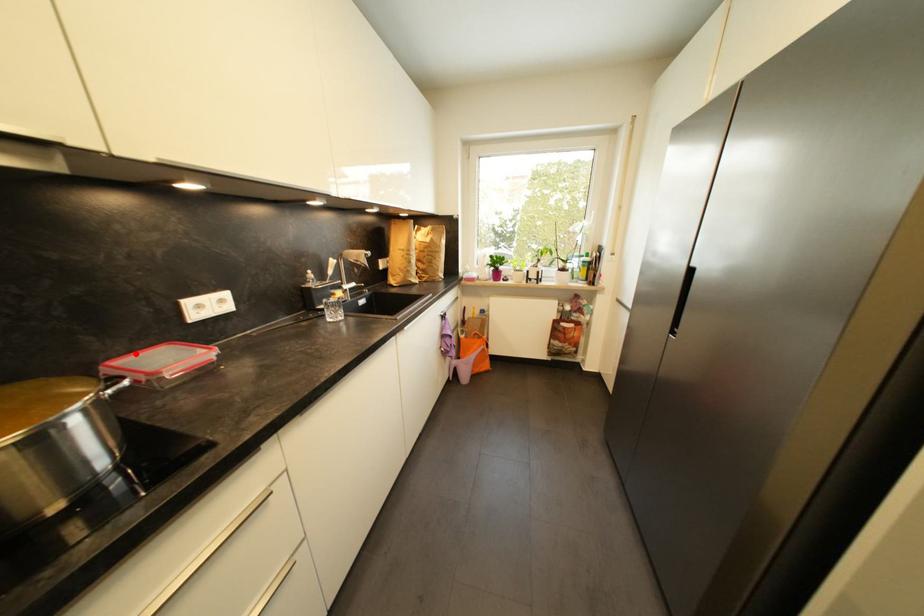
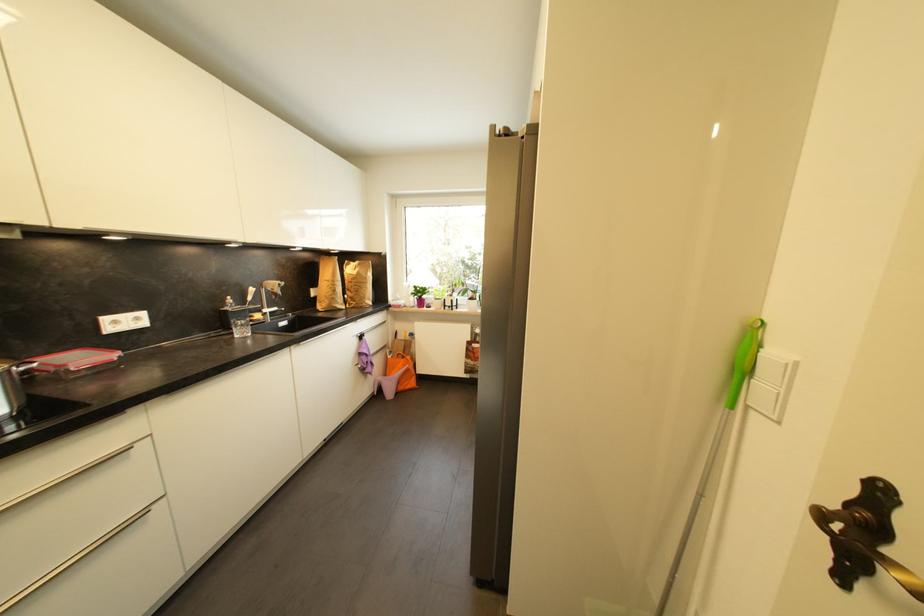
In the second image, find the point that corresponds to the highlighted location in the first image.

(54, 355)